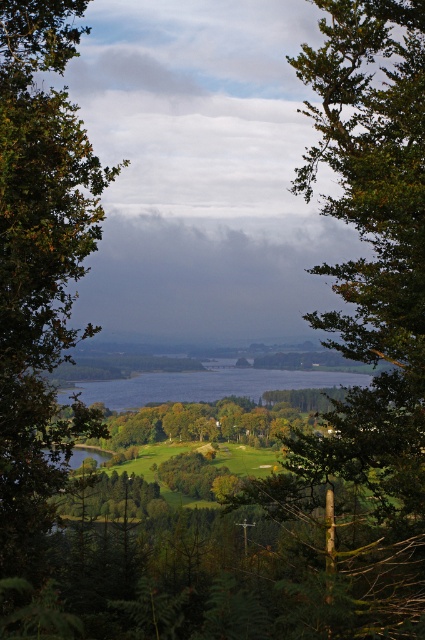
You are standing at point A with coordinates point A at [76,172] and want to walk to point B at 0.450, 0.320. The path between them is 14.06 meters. If your walking speed is 1.5 meters per second, how long will it take you to reach point B from point A?

The distance between point A at [76,172] and point B at 0.450, 0.320 is 14.06 meters. At a walking speed of 1.5 meters per second, it will take approximately 9.37 seconds to reach point B.

You are a golfer standing on the tee box and you see the green leafy tree at left and the clear water at center. Which object is larger in size?

The green leafy tree at left is bigger than the clear water at center.